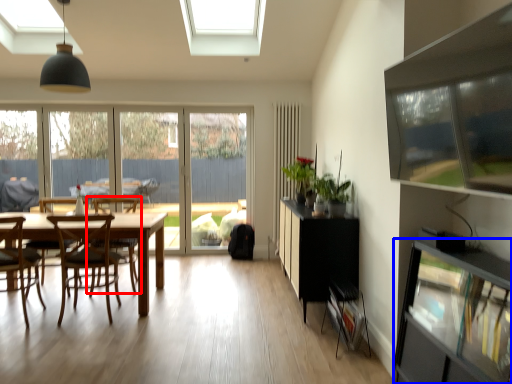
Question: Which point is closer to the camera, chair (highlighted by a red box) or shelf (highlighted by a blue box)?

Choices:
 (A) chair
 (B) shelf

Answer: (B)